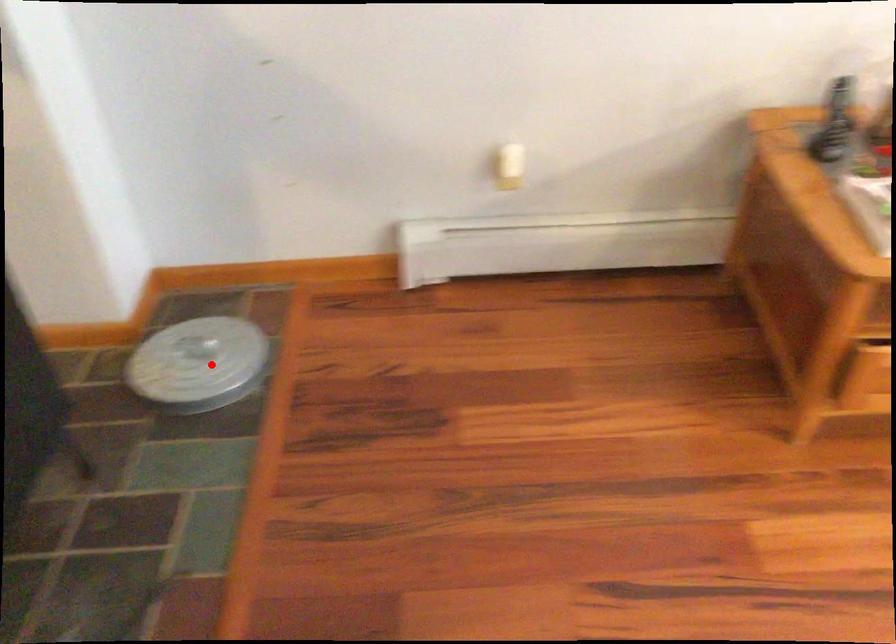
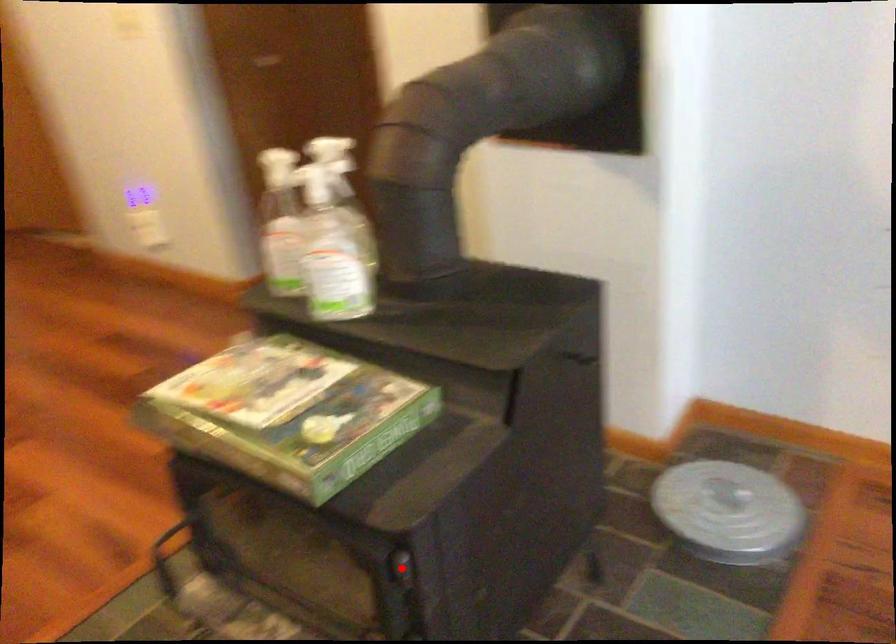
Consider the image. I am providing you with two images of the same scene from different viewpoints. A red point is marked on the first image and another point is marked on the second image. Is the marked point in image1 the same physical position as the marked point in image2?

No